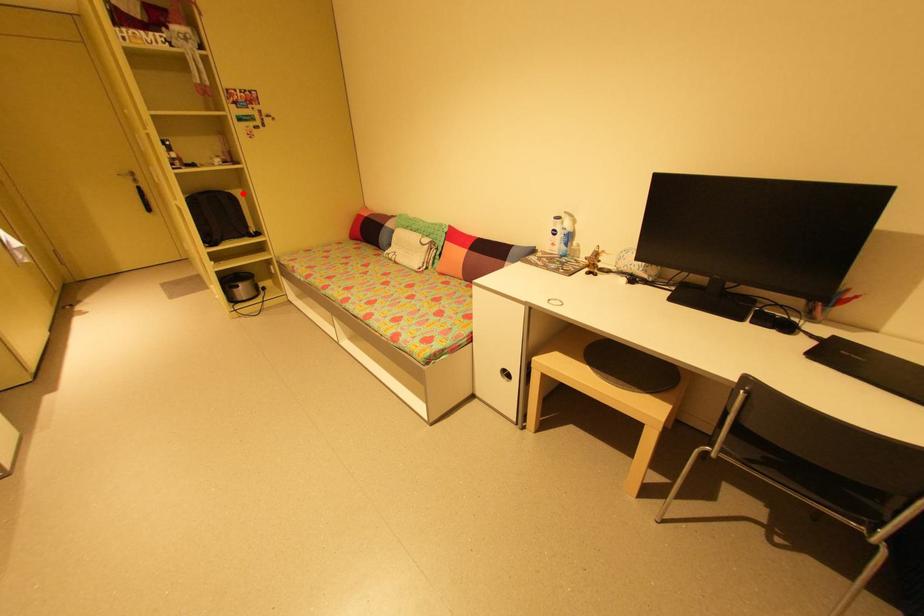
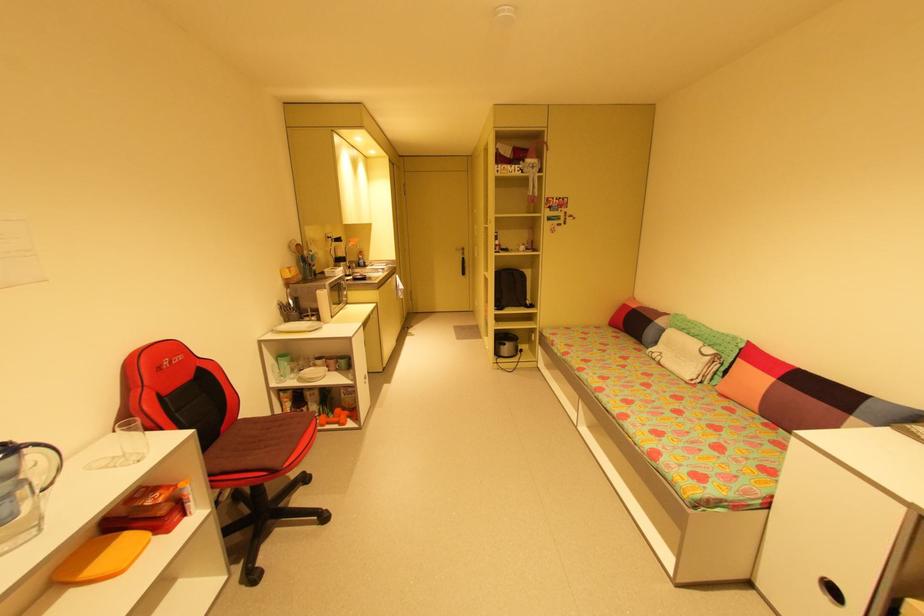
In the second image, find the point that corresponds to the highlighted location in the first image.

(532, 273)